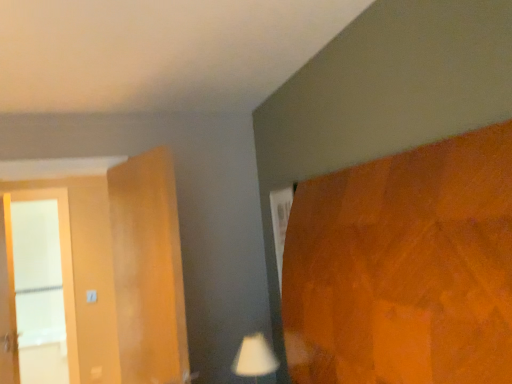
Question: Can you confirm if white matte table lamp at lower center is smaller than white glass screen door at left?

Choices:
 (A) yes
 (B) no

Answer: (A)

Question: Considering the relative positions of white matte table lamp at lower center and white glass screen door at left in the image provided, is white matte table lamp at lower center to the left of white glass screen door at left from the viewer's perspective?

Choices:
 (A) yes
 (B) no

Answer: (B)

Question: Is white glass screen door at left located within white matte table lamp at lower center?

Choices:
 (A) no
 (B) yes

Answer: (A)

Question: Considering the relative sizes of white matte table lamp at lower center and white glass screen door at left in the image provided, is white matte table lamp at lower center wider than white glass screen door at left?

Choices:
 (A) no
 (B) yes

Answer: (B)

Question: Are white matte table lamp at lower center and white glass screen door at left located far from each other?

Choices:
 (A) yes
 (B) no

Answer: (A)

Question: From the image's perspective, would you say white matte table lamp at lower center is shown under white glass screen door at left?

Choices:
 (A) yes
 (B) no

Answer: (A)

Question: Considering the relative sizes of white glass screen door at left and white matte table lamp at lower center in the image provided, is white glass screen door at left shorter than white matte table lamp at lower center?

Choices:
 (A) no
 (B) yes

Answer: (A)

Question: Is white matte table lamp at lower center inside white glass screen door at left?

Choices:
 (A) no
 (B) yes

Answer: (A)

Question: Is white glass screen door at left thinner than white matte table lamp at lower center?

Choices:
 (A) yes
 (B) no

Answer: (A)

Question: Does white glass screen door at left have a larger size compared to white matte table lamp at lower center?

Choices:
 (A) yes
 (B) no

Answer: (A)

Question: From the image's perspective, would you say white glass screen door at left is positioned over white matte table lamp at lower center?

Choices:
 (A) no
 (B) yes

Answer: (B)

Question: Is the depth of white glass screen door at left less than that of white matte table lamp at lower center?

Choices:
 (A) no
 (B) yes

Answer: (A)

Question: Visually, is white glass screen door at left positioned to the left or to the right of white matte table lamp at lower center?

Choices:
 (A) left
 (B) right

Answer: (A)